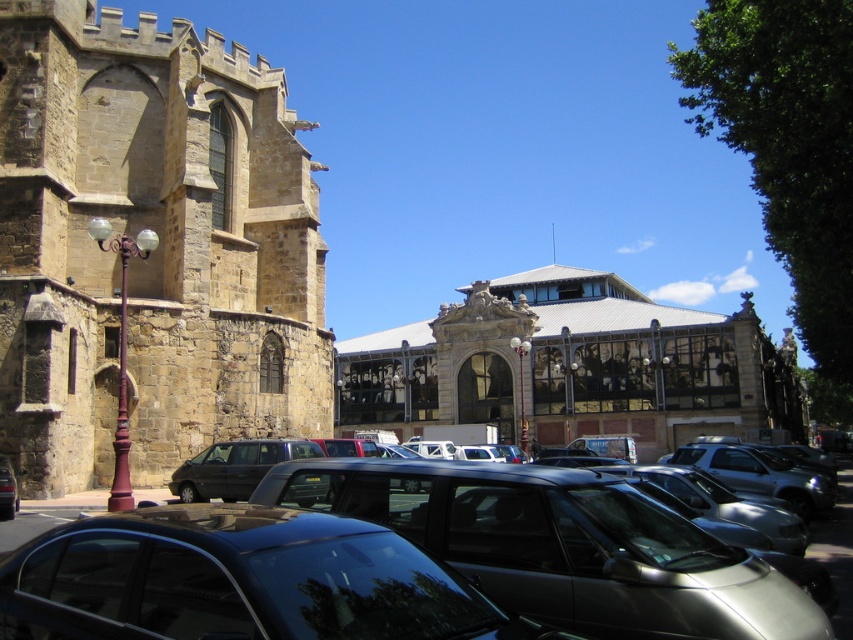
Question: Does stone glass building at center appear on the left side of metallic cars at lower center?

Choices:
 (A) no
 (B) yes

Answer: (A)

Question: Based on their relative distances, which object is farther from the glossy black car at lower center?

Choices:
 (A) metallic cars at lower center
 (B) matte black van at center

Answer: (A)

Question: Can you confirm if brown stone church at left is smaller than stone glass building at center?

Choices:
 (A) yes
 (B) no

Answer: (A)

Question: Does stone glass building at center have a greater width compared to metallic cars at lower center?

Choices:
 (A) no
 (B) yes

Answer: (B)

Question: Among these points, which one is farthest from the camera?

Choices:
 (A) tap(236, 532)
 (B) tap(343, 401)
 (C) tap(86, 266)
 (D) tap(97, 490)

Answer: (B)

Question: Which object is positioned closest to the matte black van at center?

Choices:
 (A) glossy black car at lower center
 (B) shiny black sedan at lower left
 (C) brown stone church at left
 (D) metallic cars at lower center

Answer: (A)